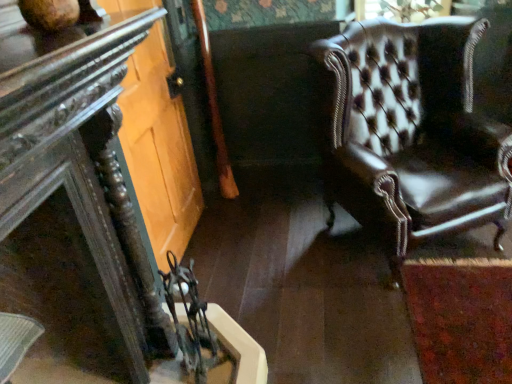
Question: In terms of size, does clear glass door at lower left appear bigger or smaller than dark wood table at left?

Choices:
 (A) small
 (B) big

Answer: (B)

Question: From a real-world perspective, is clear glass door at lower left physically located above or below dark wood table at left?

Choices:
 (A) above
 (B) below

Answer: (B)

Question: Which object is the farthest from the dark wood table at left?

Choices:
 (A) leather armchair at right
 (B) clear glass door at lower left

Answer: (A)

Question: Estimate the real-world distances between objects in this image. Which object is farther from the dark wood table at left?

Choices:
 (A) leather armchair at right
 (B) clear glass door at lower left

Answer: (A)